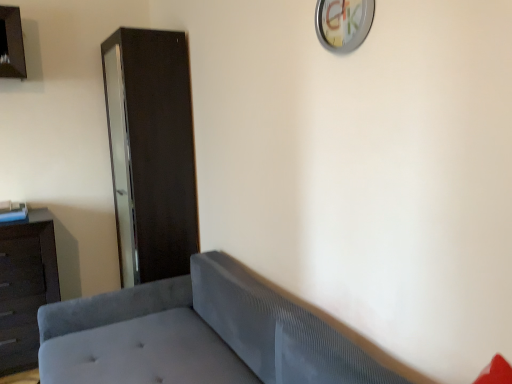
Locate an element on the screen. matte black cabinet at left is located at coordinates (151, 152).

Where is `metallic silver clock at upper center`? metallic silver clock at upper center is located at coordinates (343, 23).

Find the location of `velvet gray studio couch at lower left`. velvet gray studio couch at lower left is located at coordinates (208, 333).

What do you see at coordinates (25, 287) in the screenshot?
I see `dark brown wood dresser at left` at bounding box center [25, 287].

The width and height of the screenshot is (512, 384). I want to click on matte black cabinet at left, so click(x=151, y=152).

Is point (343, 51) positioned after point (152, 263)?

That is False.

From the image's perspective, is metallic silver clock at upper center on top of matte black cabinet at left?

Indeed, from the image's perspective, metallic silver clock at upper center is shown above matte black cabinet at left.

Can you confirm if metallic silver clock at upper center is shorter than matte black cabinet at left?

Yes.

Consider the image. Can you confirm if metallic silver clock at upper center is wider than matte black cabinet at left?

Incorrect, the width of metallic silver clock at upper center does not surpass that of matte black cabinet at left.

Is dark brown wood dresser at left looking in the opposite direction of velvet gray studio couch at lower left?

That's not correct — dark brown wood dresser at left is not looking away from velvet gray studio couch at lower left.

Is velvet gray studio couch at lower left a part of dark brown wood dresser at left?

Definitely not — velvet gray studio couch at lower left is not inside dark brown wood dresser at left.

From the image's perspective, is dark brown wood dresser at left above matte black cabinet at left?

No, from the image's perspective, dark brown wood dresser at left is not over matte black cabinet at left.

From a real-world perspective, is dark brown wood dresser at left positioned under matte black cabinet at left based on gravity?

Correct, in the physical world, dark brown wood dresser at left is lower than matte black cabinet at left.

Would you say dark brown wood dresser at left contains matte black cabinet at left?

Actually, matte black cabinet at left is outside dark brown wood dresser at left.

Considering the relative sizes of velvet gray studio couch at lower left and dark brown wood dresser at left in the image provided, is velvet gray studio couch at lower left smaller than dark brown wood dresser at left?

No, velvet gray studio couch at lower left is not smaller than dark brown wood dresser at left.

From a real-world perspective, between velvet gray studio couch at lower left and dark brown wood dresser at left, who is vertically higher?

dark brown wood dresser at left is physically above.

How different are the orientations of velvet gray studio couch at lower left and dark brown wood dresser at left in degrees?

There is a 90.8-degree angle between the facing directions of velvet gray studio couch at lower left and dark brown wood dresser at left.

Is point (203, 260) behind point (23, 330)?

That is False.

Considering the relative positions of velvet gray studio couch at lower left and metallic silver clock at upper center in the image provided, is velvet gray studio couch at lower left to the left of metallic silver clock at upper center from the viewer's perspective?

Yes, velvet gray studio couch at lower left is to the left of metallic silver clock at upper center.

Does velvet gray studio couch at lower left have a smaller size compared to metallic silver clock at upper center?

No.

Could you tell me if velvet gray studio couch at lower left is facing metallic silver clock at upper center?

No, velvet gray studio couch at lower left is not facing towards metallic silver clock at upper center.

Is velvet gray studio couch at lower left not inside metallic silver clock at upper center?

Indeed, velvet gray studio couch at lower left is completely outside metallic silver clock at upper center.

Considering the positions of objects matte black cabinet at left and dark brown wood dresser at left in the image provided, who is in front, matte black cabinet at left or dark brown wood dresser at left?

dark brown wood dresser at left is closer to the camera.

Is matte black cabinet at left to the left or to the right of dark brown wood dresser at left in the image?

matte black cabinet at left is to the right of dark brown wood dresser at left.

Between matte black cabinet at left and dark brown wood dresser at left, which one has larger width?

With larger width is dark brown wood dresser at left.

From the image's perspective, which is above, matte black cabinet at left or dark brown wood dresser at left?

matte black cabinet at left appears higher in the image.

Is point (57, 287) behind point (337, 52)?

Yes, point (57, 287) is farther from viewer.

Is dark brown wood dresser at left positioned with its back to metallic silver clock at upper center?

No, dark brown wood dresser at left's orientation is not away from metallic silver clock at upper center.

Who is smaller, dark brown wood dresser at left or metallic silver clock at upper center?

With smaller size is metallic silver clock at upper center.

Is dark brown wood dresser at left at the right side of metallic silver clock at upper center?

No, dark brown wood dresser at left is not to the right of metallic silver clock at upper center.

You are a GUI agent. You are given a task and a screenshot of the screen. Output one action in this format:
    pyautogui.click(x=<x>, y=<y>)
    Task: Click on the clock in front of the matte black cabinet at left
    This screenshot has width=512, height=384.
    Given the screenshot: What is the action you would take?
    pyautogui.click(x=343, y=23)

Where is `dresser located above the velvet gray studio couch at lower left (from a real-world perspective)`? The height and width of the screenshot is (384, 512). dresser located above the velvet gray studio couch at lower left (from a real-world perspective) is located at coordinates (25, 287).

Considering their positions, is velvet gray studio couch at lower left positioned further to matte black cabinet at left than dark brown wood dresser at left?

velvet gray studio couch at lower left lies further to matte black cabinet at left than the other object.

From the image, which object appears to be farther from metallic silver clock at upper center, dark brown wood dresser at left or matte black cabinet at left?

dark brown wood dresser at left lies further to metallic silver clock at upper center than the other object.

Based on their spatial positions, is velvet gray studio couch at lower left or matte black cabinet at left further from dark brown wood dresser at left?

velvet gray studio couch at lower left is positioned further to the anchor dark brown wood dresser at left.

Looking at the image, which one is located further to matte black cabinet at left, dark brown wood dresser at left or velvet gray studio couch at lower left?

velvet gray studio couch at lower left is further to matte black cabinet at left.

Based on their spatial positions, is matte black cabinet at left or dark brown wood dresser at left further from velvet gray studio couch at lower left?

dark brown wood dresser at left is further to velvet gray studio couch at lower left.

Estimate the real-world distances between objects in this image. Which object is further from metallic silver clock at upper center, matte black cabinet at left or dark brown wood dresser at left?

dark brown wood dresser at left lies further to metallic silver clock at upper center than the other object.

Which object lies further to the anchor point dark brown wood dresser at left, velvet gray studio couch at lower left or metallic silver clock at upper center?

metallic silver clock at upper center is further to dark brown wood dresser at left.

Considering their positions, is matte black cabinet at left positioned closer to dark brown wood dresser at left than metallic silver clock at upper center?

The object closer to dark brown wood dresser at left is matte black cabinet at left.

Find the location of a particular element. This screenshot has width=512, height=384. file cabinet between dark brown wood dresser at left and metallic silver clock at upper center from left to right is located at coordinates (151, 152).

Find the location of a particular element. studio couch situated between dark brown wood dresser at left and metallic silver clock at upper center from left to right is located at coordinates (208, 333).

This screenshot has width=512, height=384. What are the coordinates of `clock located between velvet gray studio couch at lower left and matte black cabinet at left in the depth direction` in the screenshot? It's located at (343, 23).

The width and height of the screenshot is (512, 384). Find the location of `dresser between velvet gray studio couch at lower left and matte black cabinet at left along the z-axis`. dresser between velvet gray studio couch at lower left and matte black cabinet at left along the z-axis is located at coordinates (25, 287).